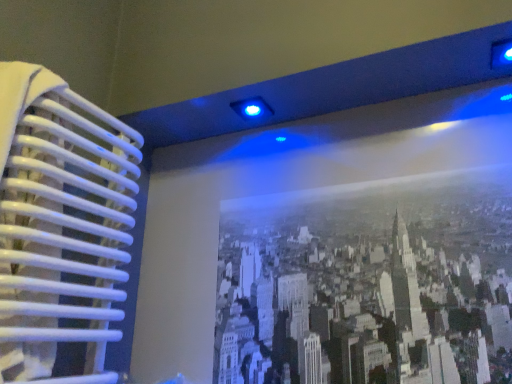
This screenshot has height=384, width=512. Find the location of `white plastic radiator at left`. white plastic radiator at left is located at coordinates (61, 226).

This screenshot has height=384, width=512. Describe the element at coordinates (61, 226) in the screenshot. I see `white plastic radiator at left` at that location.

Measure the distance between point (96, 310) and camera.

Point (96, 310) is 34.65 inches away from camera.

This screenshot has width=512, height=384. In order to click on white plastic radiator at left in this screenshot , I will do `click(61, 226)`.